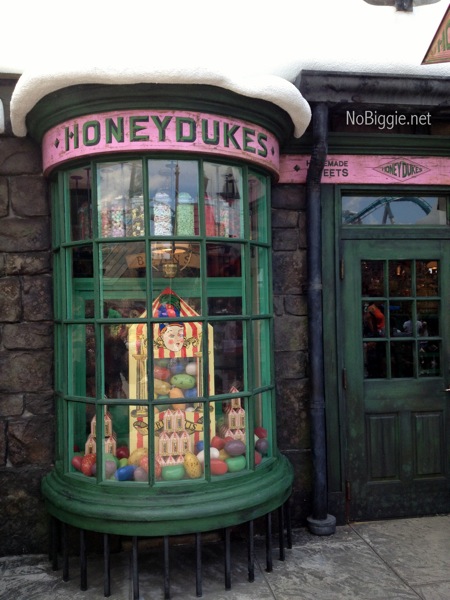
Find the location of `door`. door is located at coordinates (399, 248).